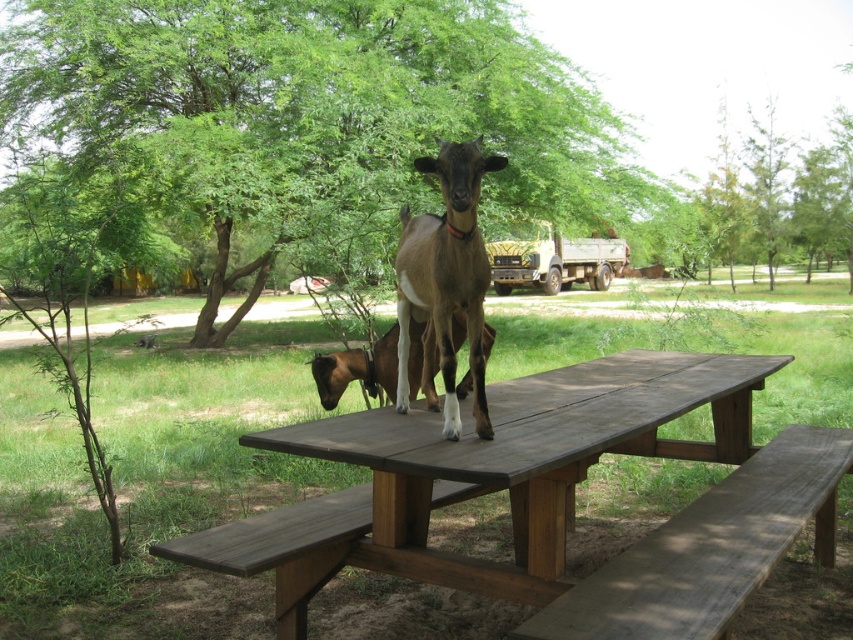
Does point (474, 468) come in front of point (409, 380)?

Yes, it is.

Who is lower down, brown wooden picnic table at center or brown fur goat at center?

brown wooden picnic table at center

Locate an element on the screen. This screenshot has width=853, height=640. brown wooden picnic table at center is located at coordinates (477, 476).

How much distance is there between brown matte goat at center and brown fur goat at center?

The distance of brown matte goat at center from brown fur goat at center is 17.53 inches.

Is the position of brown matte goat at center less distant than that of brown fur goat at center?

Yes, it is in front of brown fur goat at center.

Which is behind, point (431, 170) or point (329, 380)?

Positioned behind is point (329, 380).

Locate an element on the screen. The height and width of the screenshot is (640, 853). brown matte goat at center is located at coordinates (445, 275).

Is green leafy tree at center taller than brown fur goat at center?

Yes, green leafy tree at center is taller than brown fur goat at center.

Who is more forward, (368, 138) or (468, 374)?

Positioned in front is point (468, 374).

Locate an element on the screen. The image size is (853, 640). green leafy tree at center is located at coordinates (311, 108).